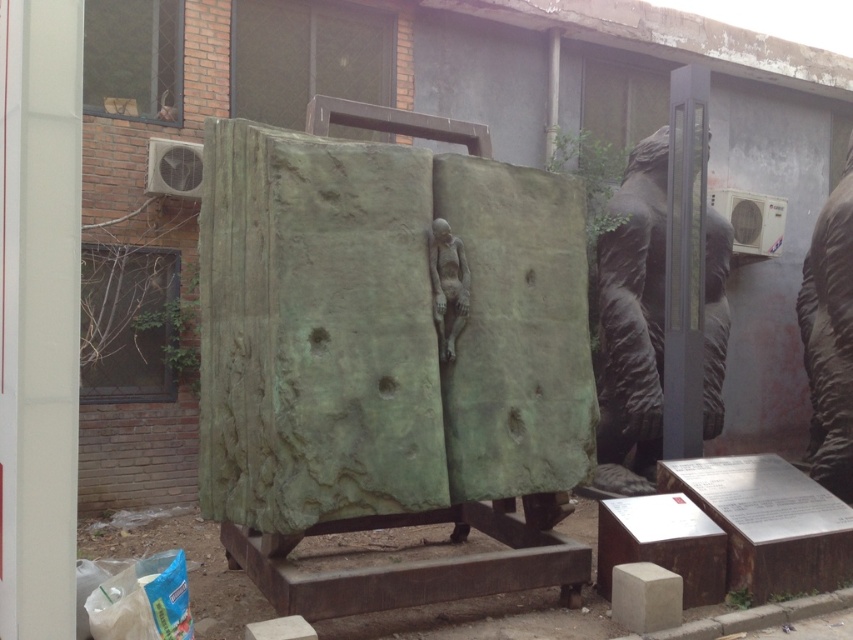
Question: Is green stone statue at right thinner than bronze statue at center?

Choices:
 (A) yes
 (B) no

Answer: (B)

Question: Which of the following is the farthest from the observer?

Choices:
 (A) bronze statue at center
 (B) green stone statue at right

Answer: (B)

Question: Is bronze statue at right above bronze statue at center?

Choices:
 (A) no
 (B) yes

Answer: (B)

Question: Which point appears farthest from the camera in this image?

Choices:
 (A) (833, 465)
 (B) (619, 310)
 (C) (453, 268)

Answer: (B)

Question: In this image, where is bronze statue at right located relative to bronze statue at center?

Choices:
 (A) right
 (B) left

Answer: (A)

Question: Which object is farther from the camera taking this photo?

Choices:
 (A) bronze statue at center
 (B) green stone statue at right
 (C) bronze statue at right

Answer: (C)